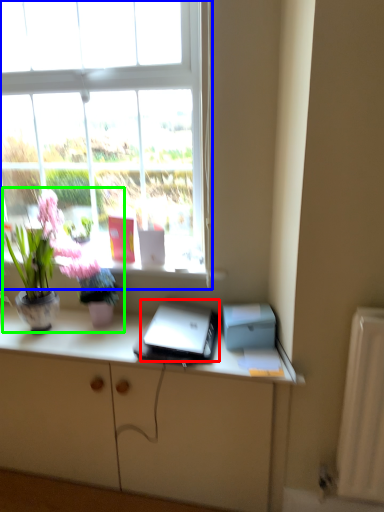
Question: Based on their relative distances, which object is nearer to laptop (highlighted by a red box)? Choose from window (highlighted by a blue box) and houseplant (highlighted by a green box).

Choices:
 (A) window
 (B) houseplant

Answer: (B)